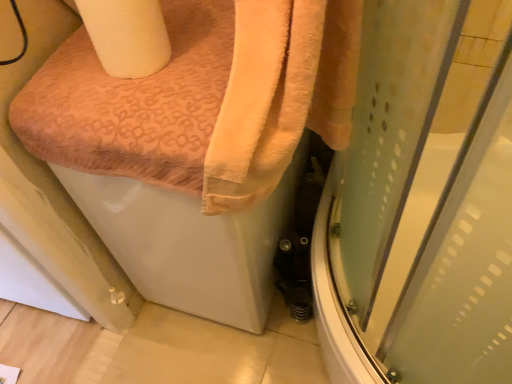
I want to click on free space in front of white matte toilet paper at upper left, so click(152, 93).